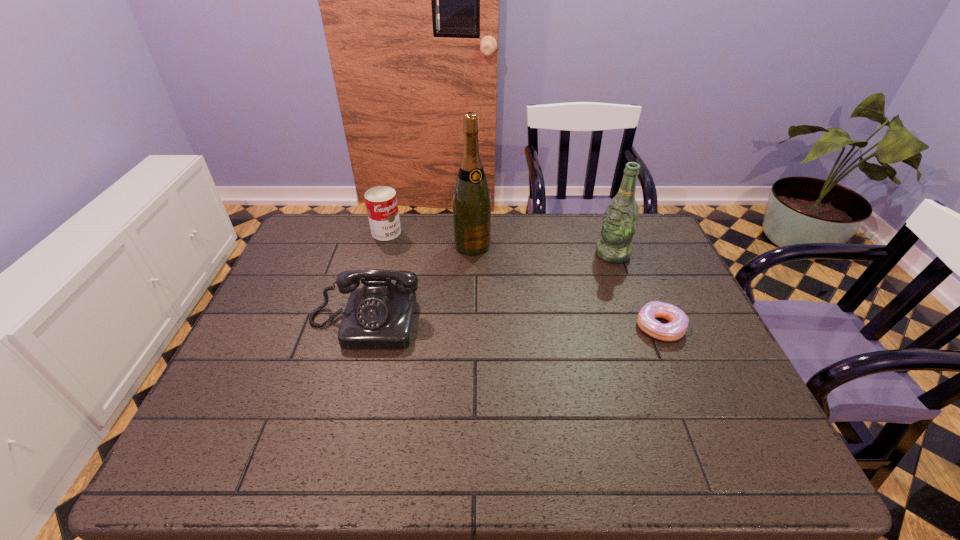
Find the location of a particular element. This screenshot has height=540, width=960. free region that satisfies the following two spatial constraints: 1. on the front side of the tallest object; 2. on the right side of the shortest object is located at coordinates (470, 327).

Identify the location of vacant region that satisfies the following two spatial constraints: 1. on the front side of the third object from left to right; 2. on the right side of the second tallest object. (472, 254).